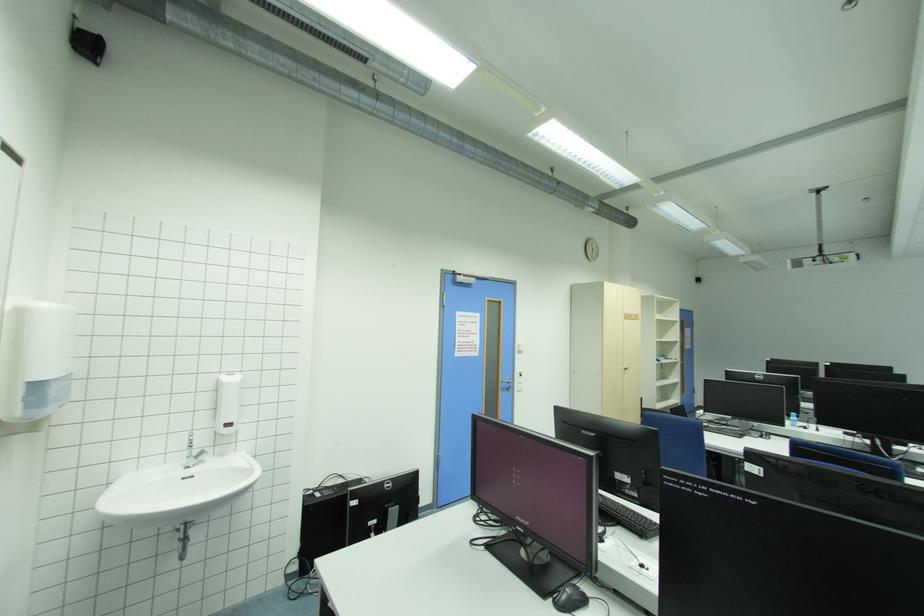
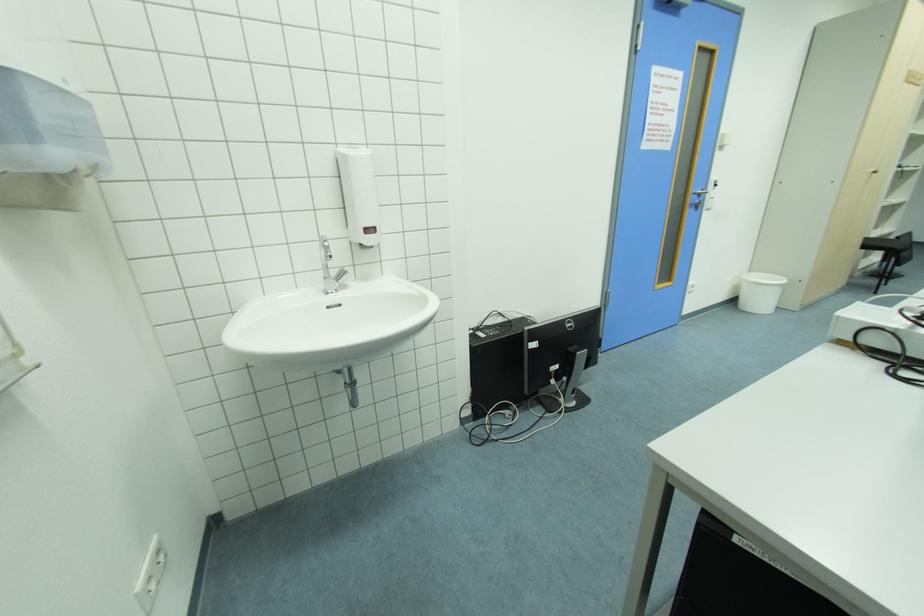
Where in the second image is the point corresponding to pixel 514 387 from the first image?

(702, 201)